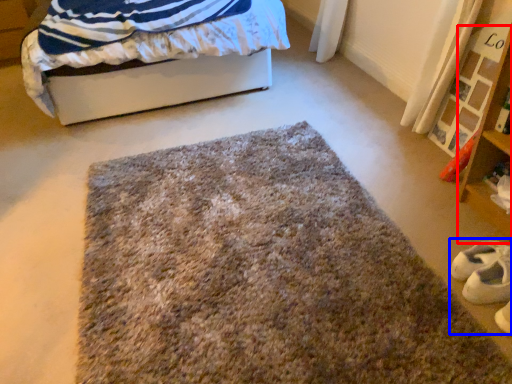
Question: Which object appears farthest to the camera in this image, shelf (highlighted by a red box) or shoe (highlighted by a blue box)?

Choices:
 (A) shelf
 (B) shoe

Answer: (B)